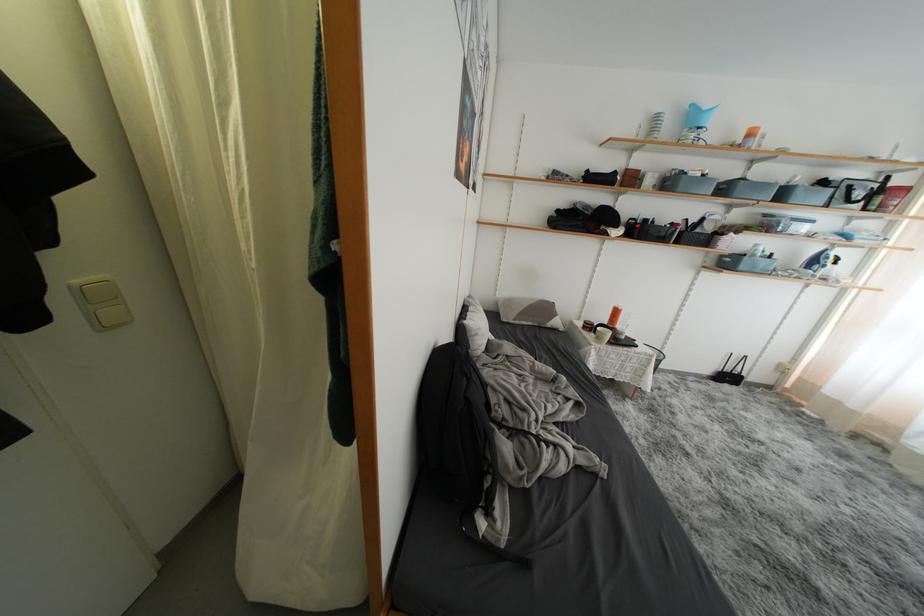
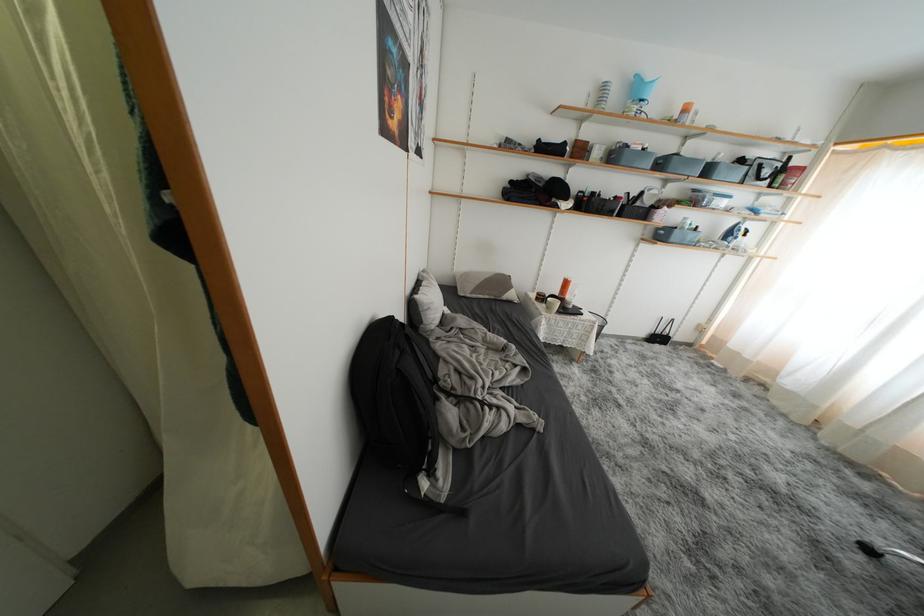
Question: The images are taken continuously from a first-person perspective. In which direction are you moving?

Choices:
 (A) Left
 (B) Right
 (C) Forward
 (D) Backward

Answer: (B)